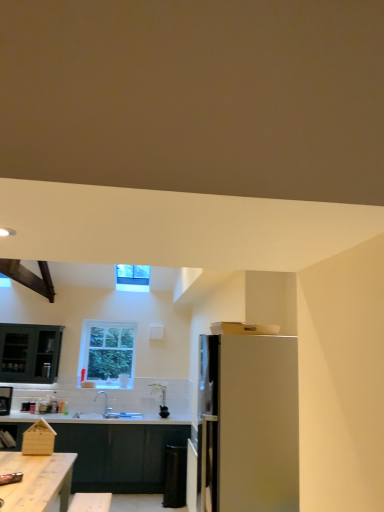
Question: Considering the relative sizes of dark wood exhaust hood at upper left and dark gray matte cabinetry at lower center in the image provided, is dark wood exhaust hood at upper left thinner than dark gray matte cabinetry at lower center?

Choices:
 (A) no
 (B) yes

Answer: (A)

Question: Is dark wood exhaust hood at upper left shorter than dark gray matte cabinetry at lower center?

Choices:
 (A) yes
 (B) no

Answer: (A)

Question: Does dark wood exhaust hood at upper left have a greater width compared to dark gray matte cabinetry at lower center?

Choices:
 (A) no
 (B) yes

Answer: (B)

Question: From a real-world perspective, is dark wood exhaust hood at upper left positioned over dark gray matte cabinetry at lower center based on gravity?

Choices:
 (A) yes
 (B) no

Answer: (A)

Question: Could you tell me if dark wood exhaust hood at upper left is turned towards dark gray matte cabinetry at lower center?

Choices:
 (A) no
 (B) yes

Answer: (A)

Question: Is dark wood exhaust hood at upper left not within dark gray matte cabinetry at lower center?

Choices:
 (A) no
 (B) yes

Answer: (B)

Question: From the image's perspective, is dark wood exhaust hood at upper left on top of white glossy refrigerator at right?

Choices:
 (A) no
 (B) yes

Answer: (B)

Question: Does dark wood exhaust hood at upper left appear on the right side of white glossy refrigerator at right?

Choices:
 (A) no
 (B) yes

Answer: (A)

Question: Does dark wood exhaust hood at upper left lie behind white glossy refrigerator at right?

Choices:
 (A) no
 (B) yes

Answer: (B)

Question: From a real-world perspective, is dark wood exhaust hood at upper left physically above white glossy refrigerator at right?

Choices:
 (A) yes
 (B) no

Answer: (A)

Question: Is dark wood exhaust hood at upper left next to white glossy refrigerator at right and touching it?

Choices:
 (A) no
 (B) yes

Answer: (A)

Question: Considering the relative positions of dark wood exhaust hood at upper left and white glossy refrigerator at right in the image provided, is dark wood exhaust hood at upper left to the left of white glossy refrigerator at right from the viewer's perspective?

Choices:
 (A) yes
 (B) no

Answer: (A)

Question: Does wooden table at lower left come in front of metallic silver toaster at lower left?

Choices:
 (A) no
 (B) yes

Answer: (B)